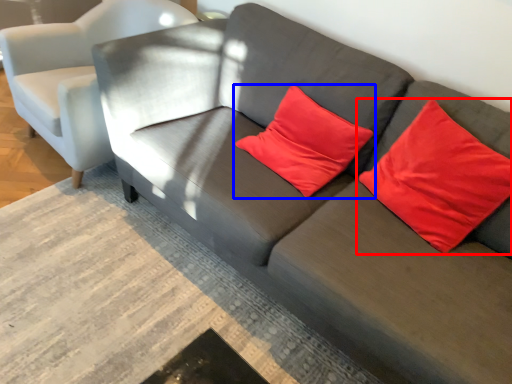
Question: Which of the following is the farthest to the observer, pillow (highlighted by a red box) or pillow (highlighted by a blue box)?

Choices:
 (A) pillow
 (B) pillow

Answer: (B)